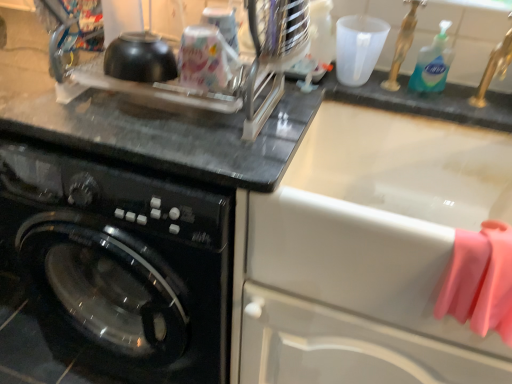
Question: Considering the positions of black glossy washing machine at left and white glossy sink at upper right in the image, is black glossy washing machine at left taller or shorter than white glossy sink at upper right?

Choices:
 (A) tall
 (B) short

Answer: (A)

Question: Visually, is black glossy washing machine at left positioned to the left or to the right of white glossy sink at upper right?

Choices:
 (A) left
 (B) right

Answer: (A)

Question: Estimate the real-world distances between objects in this image. Which object is closer to the black glossy washing machine at left?

Choices:
 (A) pink rubber gloves at right
 (B) blue liquid soap at upper right
 (C) white glossy sink at upper right

Answer: (C)

Question: Considering the real-world distances, which object is closest to the pink rubber gloves at right?

Choices:
 (A) white glossy sink at upper right
 (B) black glossy washing machine at left
 (C) blue liquid soap at upper right

Answer: (A)